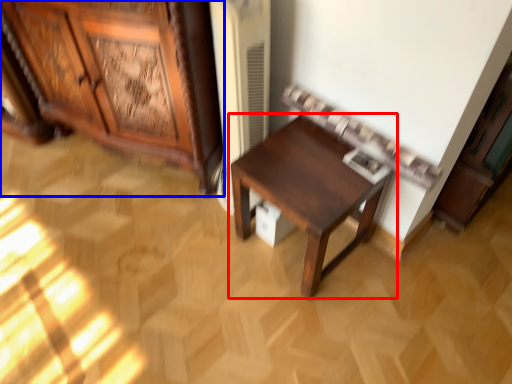
Question: Among these objects, which one is nearest to the camera, table (highlighted by a red box) or cabinetry (highlighted by a blue box)?

Choices:
 (A) table
 (B) cabinetry

Answer: (B)